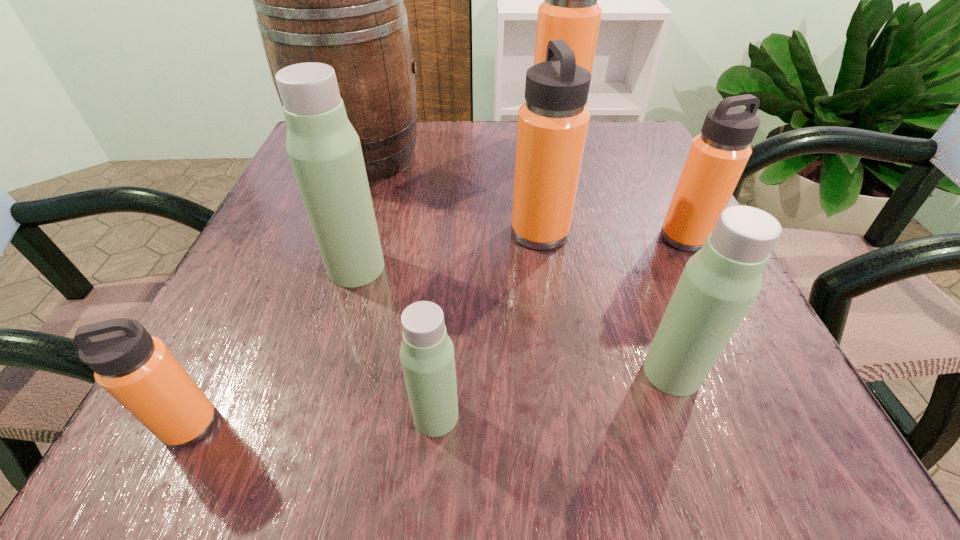
Identify which thermos bottle is the third closest to the second light thermos bottle from left to right. Please provide its 2D coordinates. Your answer should be formatted as a tuple, i.e. [(x, y)], where the tuple contains the x and y coordinates of a point satisfying the conditions above.

[(719, 283)]

Locate which thermos bottle is the third closest to the leftmost orange thermos bottle. Please provide its 2D coordinates. Your answer should be formatted as a tuple, i.e. [(x, y)], where the tuple contains the x and y coordinates of a point satisfying the conditions above.

[(552, 127)]

Select which orange thermos bottle appears as the closest to the leftmost orange thermos bottle. Please provide its 2D coordinates. Your answer should be formatted as a tuple, i.e. [(x, y)], where the tuple contains the x and y coordinates of a point satisfying the conditions above.

[(552, 127)]

Where is `orange thermos bottle that stands as the fourth closest to the second smallest light thermos bottle`? This screenshot has width=960, height=540. orange thermos bottle that stands as the fourth closest to the second smallest light thermos bottle is located at coordinates (570, 12).

Point out which light thermos bottle is positioned as the nearest to the third smallest orange thermos bottle. Please provide its 2D coordinates. Your answer should be formatted as a tuple, i.e. [(x, y)], where the tuple contains the x and y coordinates of a point satisfying the conditions above.

[(719, 283)]

Identify the location of light thermos bottle that is the nearest to the smallest light thermos bottle. (324, 150).

Locate an element on the screen. This screenshot has height=540, width=960. vacant space that satisfies the following two spatial constraints: 1. on the back side of the rightmost object; 2. on the right side of the sixth thermos bottle from right to left is located at coordinates (365, 238).

The image size is (960, 540). I want to click on vacant space that satisfies the following two spatial constraints: 1. on the side of the cider near the bung hole; 2. on the back side of the leftmost light thermos bottle, so click(x=323, y=268).

Where is `vacant position in the image that satisfies the following two spatial constraints: 1. on the back side of the second biggest orange thermos bottle; 2. on the right side of the leftmost light thermos bottle`? The height and width of the screenshot is (540, 960). vacant position in the image that satisfies the following two spatial constraints: 1. on the back side of the second biggest orange thermos bottle; 2. on the right side of the leftmost light thermos bottle is located at coordinates (367, 233).

In order to click on free spot that satisfies the following two spatial constraints: 1. on the side of the fifth object from right to left near the bung hole; 2. on the right side of the cider in this screenshot , I will do `click(269, 416)`.